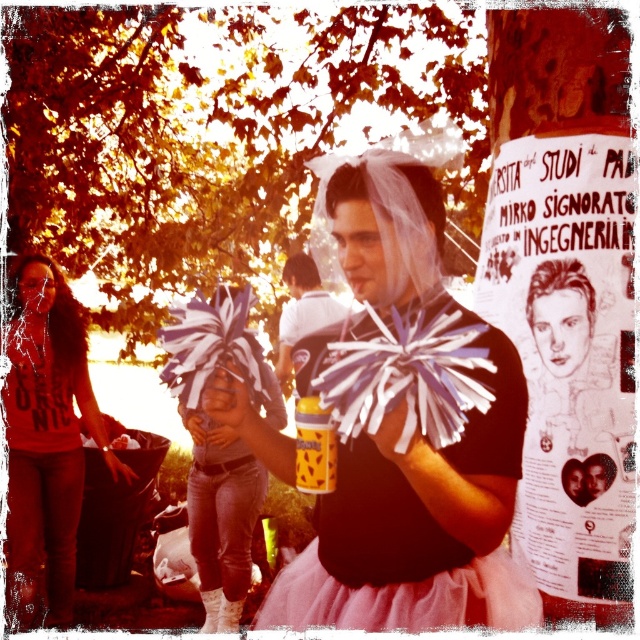
Is white paper poster at center wider than pink tulle skirt at center?

Incorrect, white paper poster at center's width does not surpass pink tulle skirt at center's.

This screenshot has width=640, height=640. I want to click on white paper poster at center, so click(x=570, y=356).

Is point (552, 468) closer to viewer compared to point (376, 525)?

No, (552, 468) is behind (376, 525).

Identify the location of white paper poster at center. (570, 356).

Is golden leaves at upper left taller than white paper poster at center?

Indeed, golden leaves at upper left has a greater height compared to white paper poster at center.

Does golden leaves at upper left appear over white paper poster at center?

Correct, golden leaves at upper left is located above white paper poster at center.

Which is in front, point (243, 24) or point (618, 202)?

Point (618, 202)

At what (x,y) coordinates should I click in order to perform the action: click on golden leaves at upper left. Please return your answer as a coordinate pair (x, y). Image resolution: width=640 pixels, height=640 pixels. Looking at the image, I should click on (202, 134).

Can you confirm if matte black hoodie at center is positioned to the right of white tulle tutu at center?

Incorrect, matte black hoodie at center is not on the right side of white tulle tutu at center.

Measure the distance from matte black hoodie at center to white tulle tutu at center.

matte black hoodie at center is 33.92 inches away from white tulle tutu at center.

At what (x,y) coordinates should I click in order to perform the action: click on matte black hoodie at center. Please return your answer as a coordinate pair (x, y). This screenshot has height=640, width=640. Looking at the image, I should click on (45, 440).